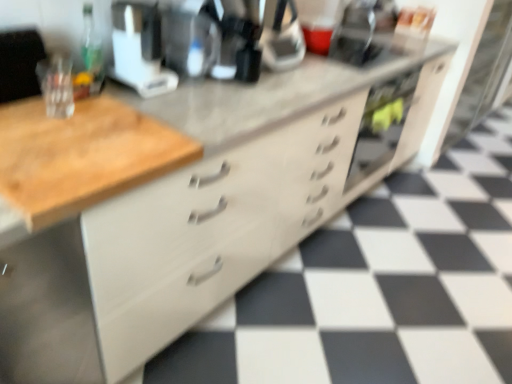
What is the approximate width of black plastic coffee machine at center?

It is 12.02 inches.

Image resolution: width=512 pixels, height=384 pixels. What do you see at coordinates (91, 54) in the screenshot?
I see `green glass bottle at upper left` at bounding box center [91, 54].

The height and width of the screenshot is (384, 512). What do you see at coordinates (139, 48) in the screenshot?
I see `white plastic coffee maker at upper center` at bounding box center [139, 48].

Where is `white plastic coffee maker at upper center`? This screenshot has width=512, height=384. white plastic coffee maker at upper center is located at coordinates (139, 48).

The width and height of the screenshot is (512, 384). In order to click on black plastic coffee machine at center in this screenshot , I will do `click(229, 38)`.

Is black plastic coffee machine at center located within white plastic coffee maker at upper center?

That's incorrect, black plastic coffee machine at center is not inside white plastic coffee maker at upper center.

Which of these two, white plastic coffee maker at upper center or black plastic coffee machine at center, is thinner?

Thinner between the two is white plastic coffee maker at upper center.

Is white plastic coffee maker at upper center placed right next to black plastic coffee machine at center?

No, white plastic coffee maker at upper center is not in contact with black plastic coffee machine at center.

From the image's perspective, is green glass bottle at upper left positioned above or below white plastic coffee maker at upper center?

From the image's perspective, green glass bottle at upper left appears below white plastic coffee maker at upper center.

Which point is more distant from viewer, (x=81, y=92) or (x=164, y=87)?

The point (x=164, y=87) is behind.

Is green glass bottle at upper left positioned with its back to white plastic coffee maker at upper center?

No, green glass bottle at upper left is not facing away from white plastic coffee maker at upper center.

Between green glass bottle at upper left and white plastic coffee maker at upper center, which one has more height?

Standing taller between the two is white plastic coffee maker at upper center.

Which of these two, black plastic coffee machine at center or green glass bottle at upper left, is wider?

With larger width is black plastic coffee machine at center.

Considering the relative positions of black plastic coffee machine at center and green glass bottle at upper left in the image provided, is black plastic coffee machine at center to the right of green glass bottle at upper left from the viewer's perspective?

Indeed, black plastic coffee machine at center is positioned on the right side of green glass bottle at upper left.

Considering the relative sizes of black plastic coffee machine at center and green glass bottle at upper left in the image provided, is black plastic coffee machine at center taller than green glass bottle at upper left?

Yes.

From the picture: From a real-world perspective, which object stands above the other?

black plastic coffee machine at center is physically above.

Is black plastic coffee machine at center completely or partially outside of white plastic coffee maker at upper center?

black plastic coffee machine at center is positioned outside white plastic coffee maker at upper center.

From a real-world perspective, is black plastic coffee machine at center positioned above or below white plastic coffee maker at upper center?

Clearly, from a real-world perspective, black plastic coffee machine at center is above white plastic coffee maker at upper center.

Is black plastic coffee machine at center wider than white plastic coffee maker at upper center?

Indeed, black plastic coffee machine at center has a greater width compared to white plastic coffee maker at upper center.

Is black plastic coffee machine at center behind white plastic coffee maker at upper center?

Yes, black plastic coffee machine at center is further from the camera.

From a real-world perspective, relative to black plastic coffee machine at center, is green glass bottle at upper left vertically above or below?

Clearly, from a real-world perspective, green glass bottle at upper left is below black plastic coffee machine at center.

In the scene shown: Considering the sizes of objects green glass bottle at upper left and black plastic coffee machine at center in the image provided, who is smaller, green glass bottle at upper left or black plastic coffee machine at center?

green glass bottle at upper left.

Is green glass bottle at upper left to the left of black plastic coffee machine at center from the viewer's perspective?

Yes, green glass bottle at upper left is to the left of black plastic coffee machine at center.

Does green glass bottle at upper left have a lesser width compared to black plastic coffee machine at center?

Yes.

From the picture: From the image's perspective, between white plastic coffee maker at upper center and green glass bottle at upper left, which one is located above?

white plastic coffee maker at upper center.

Is white plastic coffee maker at upper center wider or thinner than green glass bottle at upper left?

Considering their sizes, white plastic coffee maker at upper center looks broader than green glass bottle at upper left.

Is white plastic coffee maker at upper center facing away from green glass bottle at upper left?

No, white plastic coffee maker at upper center is not facing away from green glass bottle at upper left.

Find the location of a particular element. coffee machine above the white plastic coffee maker at upper center (from a real-world perspective) is located at coordinates (229, 38).

Where is `bottle on the left of the white plastic coffee maker at upper center`? bottle on the left of the white plastic coffee maker at upper center is located at coordinates (91, 54).

Estimate the real-world distances between objects in this image. Which object is closer to black plastic coffee machine at center, white plastic coffee maker at upper center or green glass bottle at upper left?

white plastic coffee maker at upper center lies closer to black plastic coffee machine at center than the other object.

Based on their spatial positions, is black plastic coffee machine at center or green glass bottle at upper left further from white plastic coffee maker at upper center?

The object further to white plastic coffee maker at upper center is black plastic coffee machine at center.

Considering their positions, is green glass bottle at upper left positioned further to black plastic coffee machine at center than white plastic coffee maker at upper center?

green glass bottle at upper left.

From the image, which object appears to be farther from white plastic coffee maker at upper center, green glass bottle at upper left or black plastic coffee machine at center?

black plastic coffee machine at center.

Looking at the image, which one is located further to green glass bottle at upper left, black plastic coffee machine at center or white plastic coffee maker at upper center?

black plastic coffee machine at center is further to green glass bottle at upper left.

Looking at the image, which one is located closer to green glass bottle at upper left, white plastic coffee maker at upper center or black plastic coffee machine at center?

white plastic coffee maker at upper center lies closer to green glass bottle at upper left than the other object.

I want to click on appliance situated between green glass bottle at upper left and black plastic coffee machine at center from left to right, so click(139, 48).